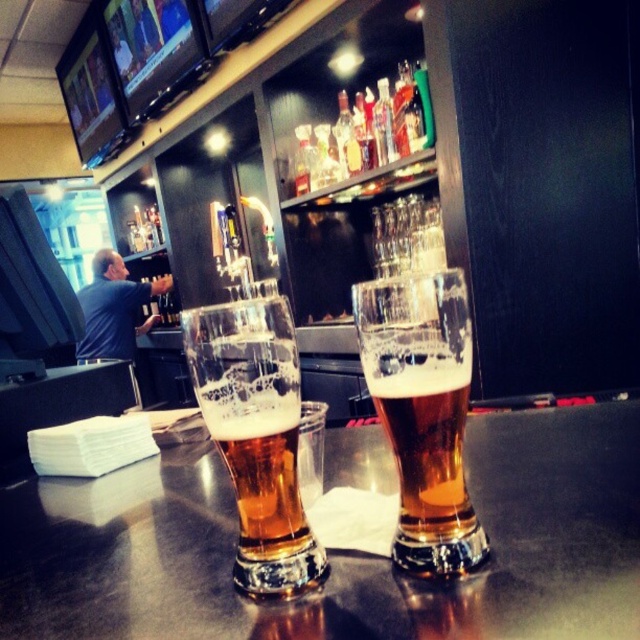
Can you confirm if translucent glass beer at center is wider than blue shirt at left?

Incorrect, translucent glass beer at center's width does not surpass blue shirt at left's.

Where is `translucent glass beer at center`? translucent glass beer at center is located at coordinates (257, 435).

Between point (259, 404) and point (122, 273), which one is positioned in front?

Point (259, 404)

This screenshot has height=640, width=640. What are the coordinates of `translucent glass beer at center` in the screenshot? It's located at (257, 435).

Consider the image. Does translucent glass table at center have a greater height compared to translucent glass beer at center?

No, translucent glass table at center is not taller than translucent glass beer at center.

This screenshot has width=640, height=640. Describe the element at coordinates (337, 550) in the screenshot. I see `translucent glass table at center` at that location.

The height and width of the screenshot is (640, 640). I want to click on translucent glass table at center, so click(x=337, y=550).

Image resolution: width=640 pixels, height=640 pixels. Identify the location of translucent glass table at center. (337, 550).

How distant is translucent glass beer at center from golden glass beer at center?

translucent glass beer at center and golden glass beer at center are 0.80 inches apart from each other.

Is point (266, 314) closer to viewer compared to point (234, 458)?

That is True.

Locate an element on the screen. translucent glass beer at center is located at coordinates (257, 435).